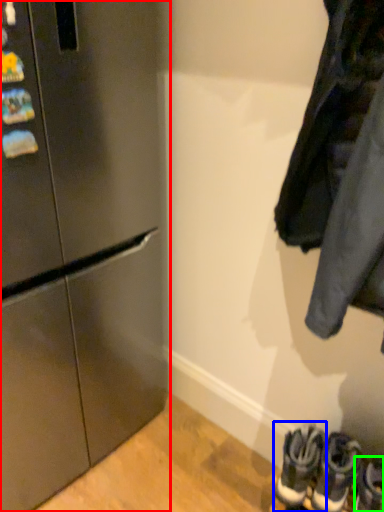
Question: Which object is positioned farthest from refrigerator (highlighted by a red box)? Select from footwear (highlighted by a blue box) and footwear (highlighted by a green box).

Choices:
 (A) footwear
 (B) footwear

Answer: (B)